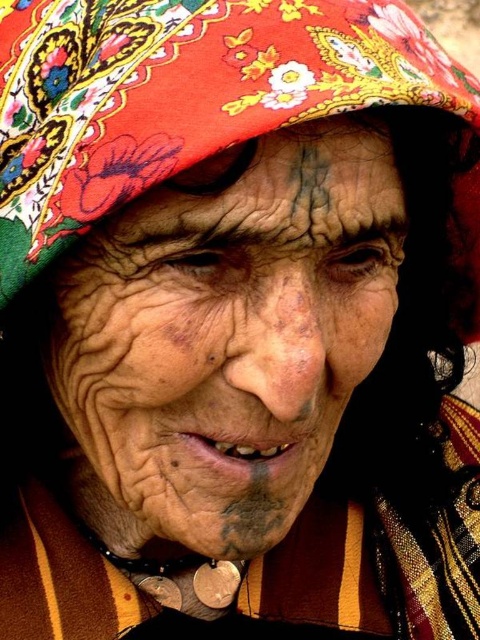
Based on the photo, can you confirm if dry skin at center is positioned below floral fabric headdress at upper center?

Correct, dry skin at center is located below floral fabric headdress at upper center.

Is dry skin at center shorter than floral fabric headdress at upper center?

No.

Which is behind, point (199, 528) or point (381, 84)?

Positioned behind is point (199, 528).

What are the coordinates of `dry skin at center` in the screenshot? It's located at (219, 348).

Between dry skin at center and dark skin forehead at upper center, which one has more height?

Standing taller between the two is dry skin at center.

You are a GUI agent. You are given a task and a screenshot of the screen. Output one action in this format:
    pyautogui.click(x=<x>, y=<y>)
    Task: Click on the dry skin at center
    The image size is (480, 640).
    Given the screenshot: What is the action you would take?
    pyautogui.click(x=219, y=348)

Is point (182, 49) farther from camera compared to point (344, 115)?

No, (182, 49) is in front of (344, 115).

Which is more to the left, floral fabric headdress at upper center or dark skin forehead at upper center?

dark skin forehead at upper center

Find the location of a particular element. floral fabric headdress at upper center is located at coordinates (181, 93).